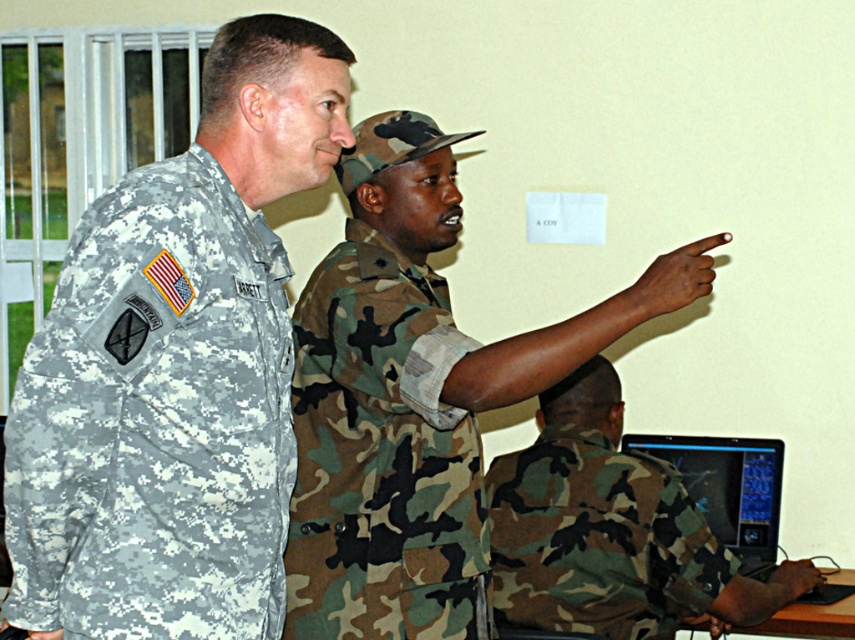
Question: Which point is farther to the camera?

Choices:
 (A) black glossy monitor at lower right
 (B) camouflage uniform at center
 (C) camo fabric uniform at center

Answer: (A)

Question: Is camo fabric uniform at center bigger than black glossy monitor at lower right?

Choices:
 (A) yes
 (B) no

Answer: (A)

Question: Which of these objects is positioned farthest from the camo uniform at lower right?

Choices:
 (A) camouflage uniform at center
 (B) camo fabric uniform at center
 (C) camouflage fabric uniform at left

Answer: (C)

Question: Is camo fabric uniform at center positioned before camo uniform at lower right?

Choices:
 (A) yes
 (B) no

Answer: (A)

Question: Which point is closer to the camera?

Choices:
 (A) black glossy monitor at lower right
 (B) camouflage uniform at center

Answer: (B)

Question: Is the position of camouflage uniform at center more distant than that of black glossy monitor at lower right?

Choices:
 (A) yes
 (B) no

Answer: (B)